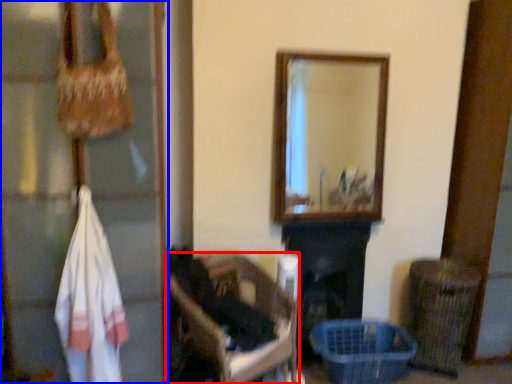
Question: Which point is closer to the camera, furniture (highlighted by a red box) or glass door (highlighted by a blue box)?

Choices:
 (A) furniture
 (B) glass door

Answer: (B)